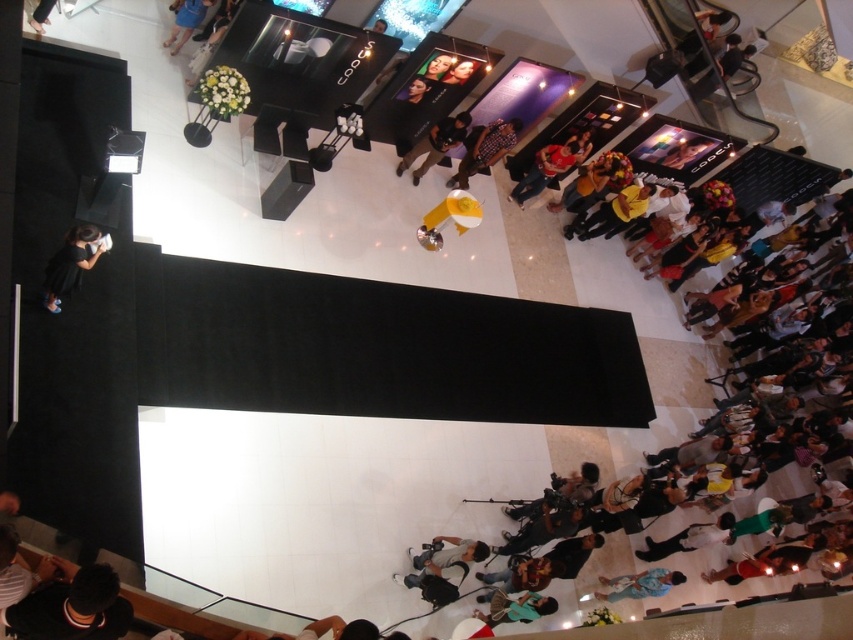
Question: Is black fuzzy hat at lower left positioned at the back of dark gray backpack at lower center?

Choices:
 (A) no
 (B) yes

Answer: (A)

Question: Does dark gray backpack at lower center come in front of blue denim shorts at upper left?

Choices:
 (A) no
 (B) yes

Answer: (B)

Question: Observing the image, what is the correct spatial positioning of dark gray backpack at lower center in reference to blue denim shorts at upper left?

Choices:
 (A) right
 (B) left

Answer: (A)

Question: Which object appears closest to the camera in this image?

Choices:
 (A) dark brown leather jacket at center
 (B) red shirt at center

Answer: (A)

Question: Which point appears closest to the camera in this image?

Choices:
 (A) (61, 618)
 (B) (201, 8)
 (C) (460, 172)
 (D) (428, 148)

Answer: (A)

Question: Which point is farther to the camera?

Choices:
 (A) dark gray backpack at lower center
 (B) black matte dress at lower left
 (C) blue denim shorts at upper left
 (D) dark brown leather jacket at center

Answer: (D)